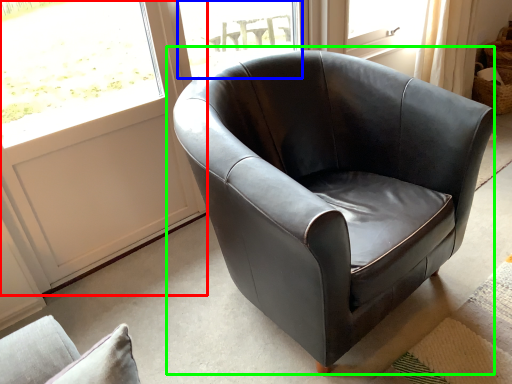
Question: Which object is positioned closest to screen door (highlighted by a red box)? Select from window (highlighted by a blue box) and chair (highlighted by a green box).

Choices:
 (A) window
 (B) chair

Answer: (A)